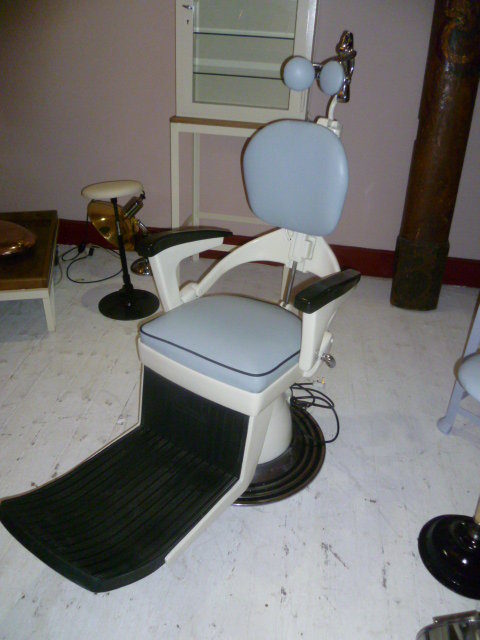
You are a GUI agent. You are given a task and a screenshot of the screen. Output one action in this format:
    pyautogui.click(x=<x>, y=<y>)
    Task: Click on the cabinet
    The image size is (480, 640).
    Given the screenshot: What is the action you would take?
    192,118